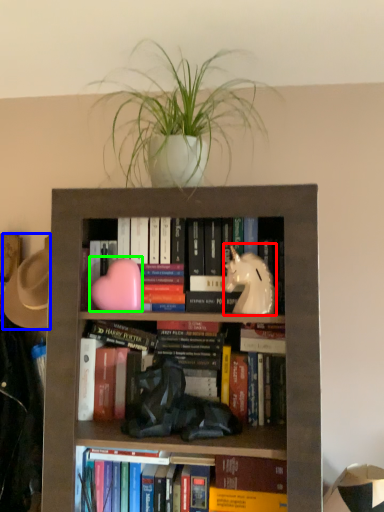
Question: Which object is positioned closest to animal (highlighted by a red box)? Select from hat (highlighted by a blue box) and animal (highlighted by a green box).

Choices:
 (A) hat
 (B) animal

Answer: (B)